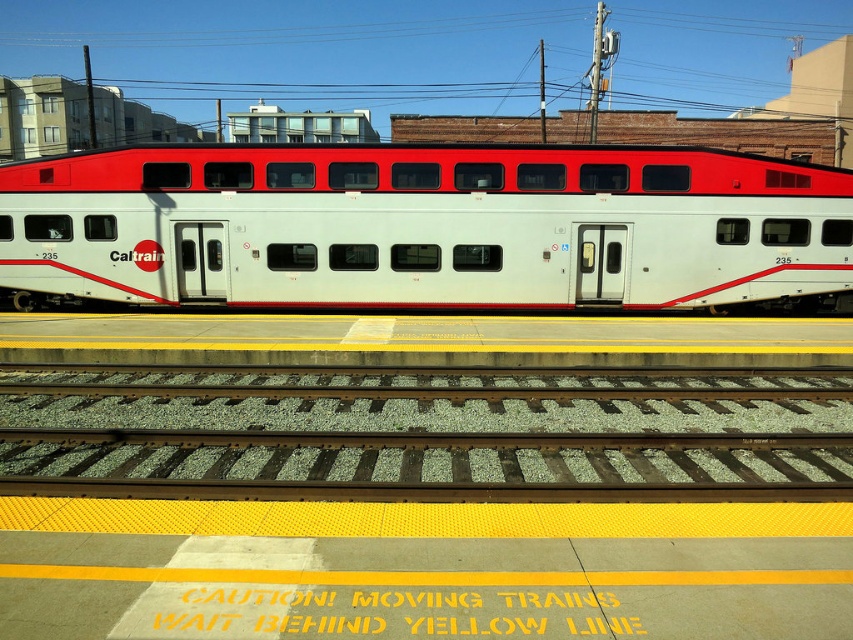
You are a visually impaired passenger standing on the platform. You feel the yellow tactile paving strip under your feet. Which object is closer to you between the white matte train car at center and the green gravel track at center?

The white matte train car at center is closer to you than the green gravel track at center because the train car is positioned further to the viewer compared to the track.